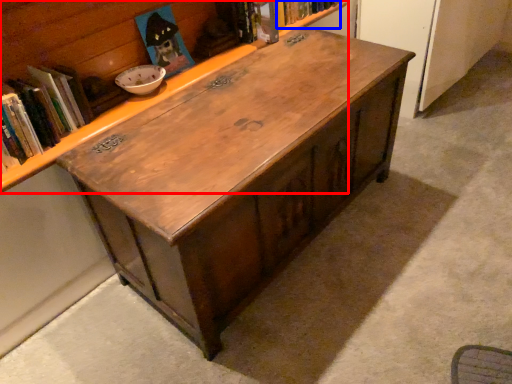
Question: Which object appears closest to the camera in this image, bookcase (highlighted by a red box) or book (highlighted by a blue box)?

Choices:
 (A) bookcase
 (B) book

Answer: (A)